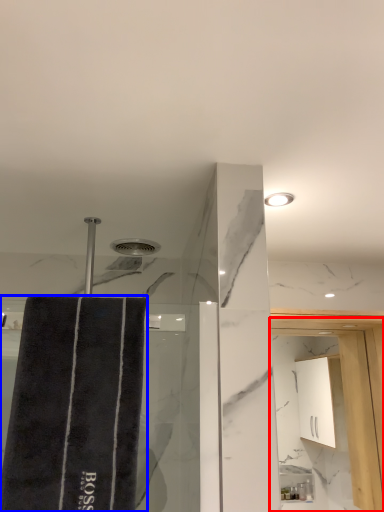
Question: Which of the following is the closest to the observer, screen door (highlighted by a red box) or bath towel (highlighted by a blue box)?

Choices:
 (A) screen door
 (B) bath towel

Answer: (B)